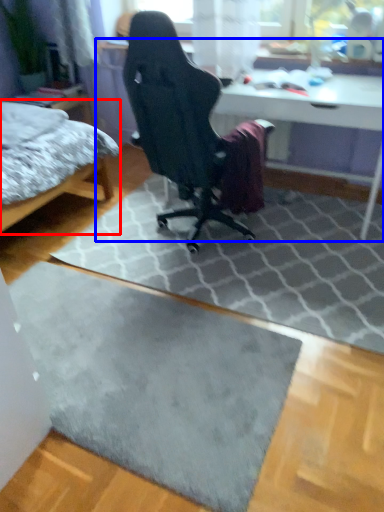
Question: Which object is closer to the camera taking this photo, bed (highlighted by a red box) or table (highlighted by a blue box)?

Choices:
 (A) bed
 (B) table

Answer: (A)